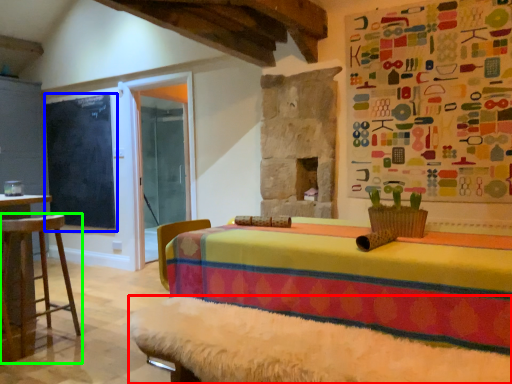
Question: Based on their relative distances, which object is nearer to bed frame (highlighted by a red box)? Choose from bulletin board (highlighted by a blue box) and furniture (highlighted by a green box).

Choices:
 (A) bulletin board
 (B) furniture

Answer: (B)